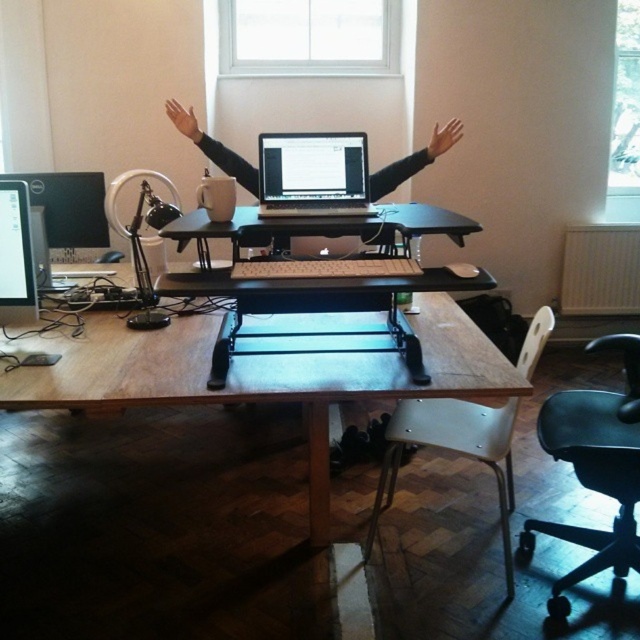
You are organizing a presentation and need to check if your hand can reach the keyboard of the satin black laptop at center without moving your arm. Based on the setup, can your brown leather hand at upper right reach the keyboard?

The satin black laptop at center is positioned under the brown leather hand at upper right, so yes, the hand can comfortably reach the keyboard.

You are setting up a new office and need to place a large rectangular box that measures 1.2 meters in length. You have the wooden table at center and the white plastic swivel chair at lower right available. Which object can accommodate the box without it hanging over the edge?

The wooden table at center can accommodate the large rectangular box since it is larger in size than the white plastic swivel chair at lower right, making it more likely to have enough space to hold the box without it hanging over the edge.

You are a person sitting in the white plastic swivel chair at lower right and want to reach the wooden table at center. Can you easily reach it without getting up?

The wooden table at center is in front of the white plastic swivel chair at lower right, so you can easily reach it without getting up.